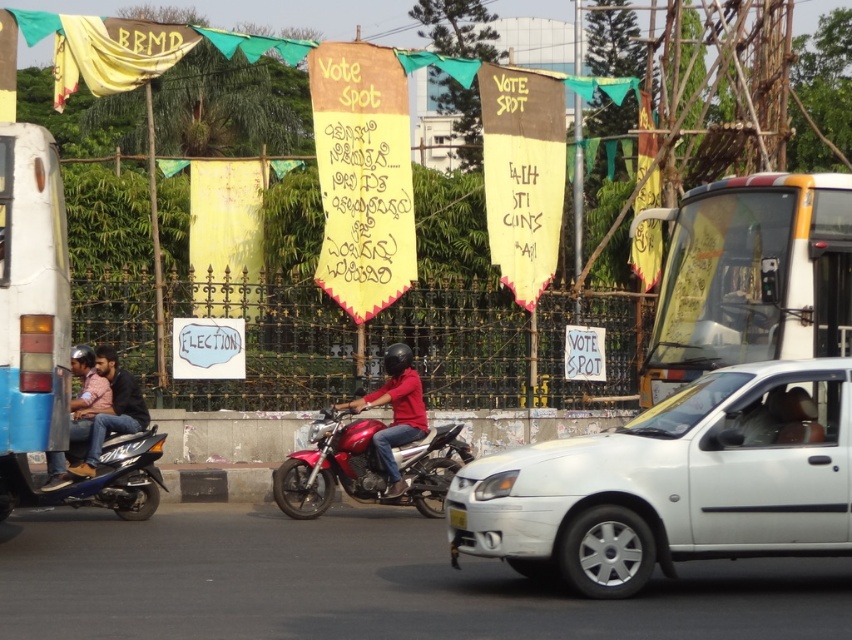
You are a drone operator trying to capture aerial footage of the political campaign banners. You have two points marked on your screen for reference. The first point is at coordinate point (14,461) and the second is at point (102,413). Which point is closer to the camera based on their positions?

Point (14,461) is in front of point (102,413), so it is closer to the camera.

You are a pedestrian standing on the sidewalk. You see a matte red motorcycle at center and a matte blue jeans at left. Which object is closer to the ground?

The matte red motorcycle at center is closer to the ground because it is located below matte blue jeans at left.